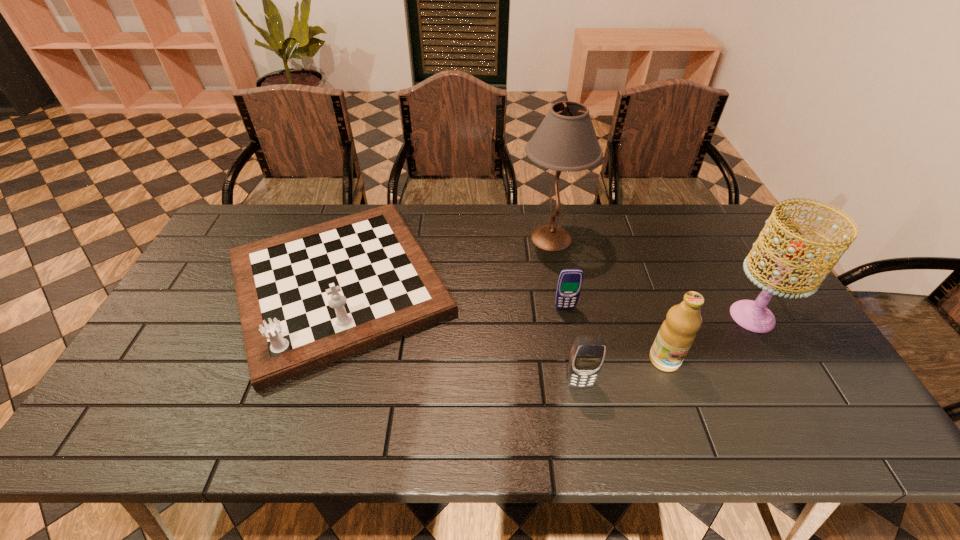
Where is `free space between the taller cellular telephone and the leftmost object`? free space between the taller cellular telephone and the leftmost object is located at coordinates tap(459, 334).

Find the location of `free area in between the leftmost object and the olive oil`. free area in between the leftmost object and the olive oil is located at coordinates (501, 322).

Where is `free space between the leftmost object and the tallest object`? The height and width of the screenshot is (540, 960). free space between the leftmost object and the tallest object is located at coordinates (444, 261).

Identify the location of vacant space that is in between the taller cellular telephone and the gameboard. This screenshot has height=540, width=960. (459, 334).

Identify the location of empty location between the gameboard and the nearer cellular telephone. (459, 334).

The height and width of the screenshot is (540, 960). I want to click on free point between the table lamp and the second object from right to left, so click(x=608, y=299).

Locate an element on the screen. This screenshot has width=960, height=540. the fourth closest object to the table lamp is located at coordinates (754, 316).

Where is `object that is the nearest to the nearer cellular telephone`? object that is the nearest to the nearer cellular telephone is located at coordinates (677, 333).

The height and width of the screenshot is (540, 960). In order to click on free space that satisfies the following two spatial constraints: 1. on the front side of the leftmost object; 2. on the left side of the lampshade in this screenshot , I will do `click(328, 316)`.

Identify the location of vacant area in the image that satisfies the following two spatial constraints: 1. on the front-facing side of the table lamp; 2. on the left side of the rightmost object. (565, 316).